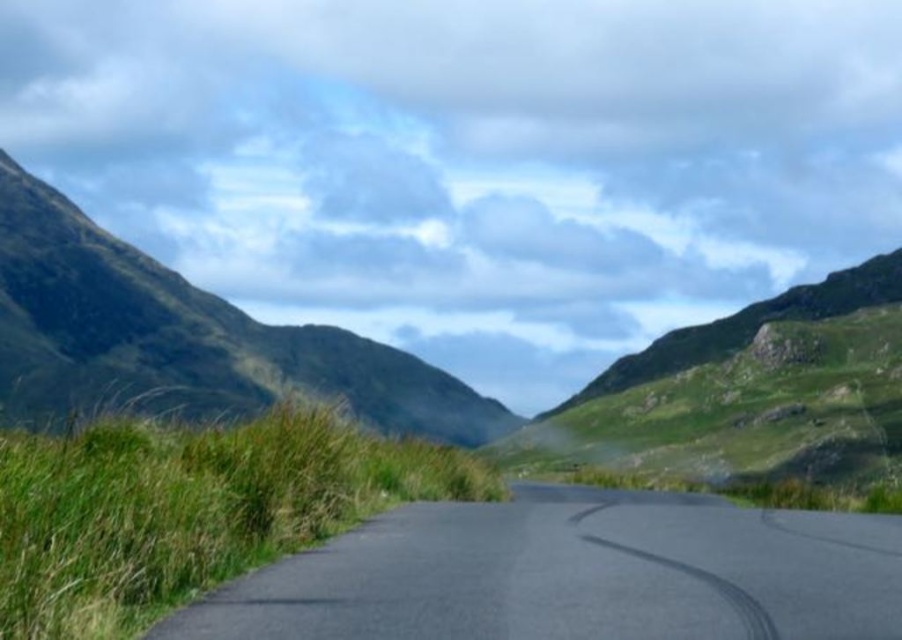
Question: Which of the following is the farthest from the observer?

Choices:
 (A) black asphalt road at center
 (B) green grassy hillside at left

Answer: (B)

Question: Among these objects, which one is farthest from the camera?

Choices:
 (A) green grassy hillside at left
 (B) black asphalt road at center

Answer: (A)

Question: Is black asphalt road at center thinner than green grassy hillside at left?

Choices:
 (A) no
 (B) yes

Answer: (B)

Question: Which point is farther to the camera?

Choices:
 (A) green grassy hillside at left
 (B) black asphalt road at center

Answer: (A)

Question: Is black asphalt road at center closer to the viewer compared to green grassy hillside at left?

Choices:
 (A) no
 (B) yes

Answer: (B)

Question: Does black asphalt road at center have a larger size compared to green grassy hillside at left?

Choices:
 (A) yes
 (B) no

Answer: (B)